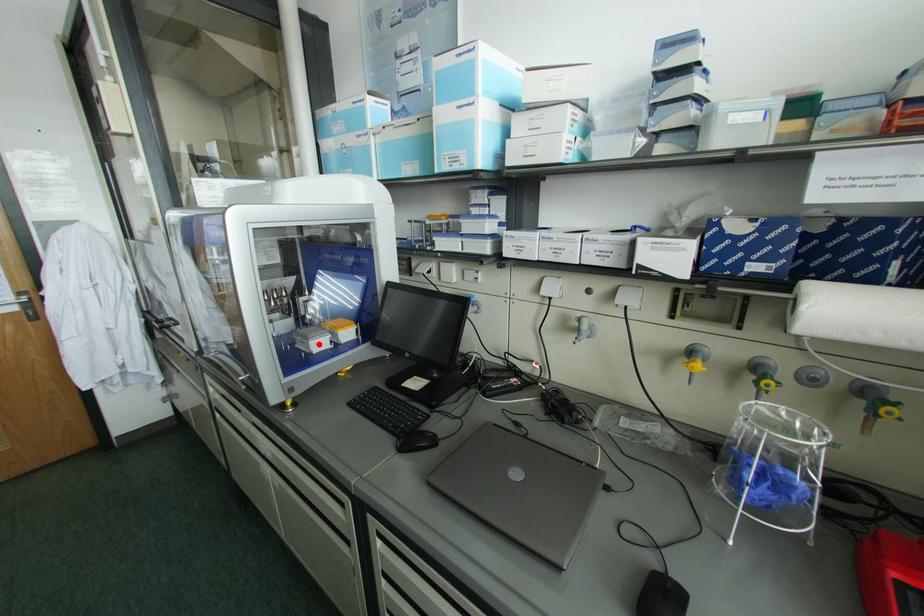
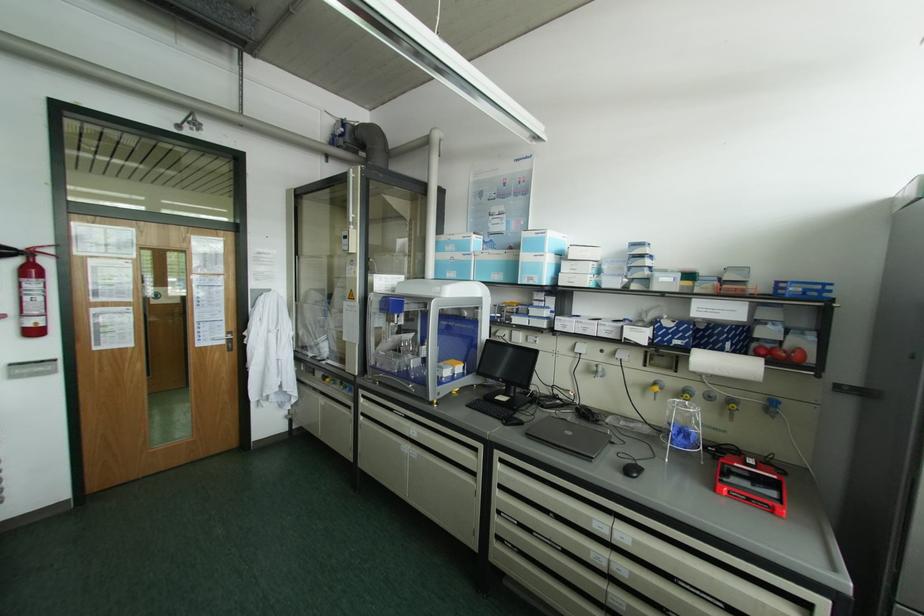
Locate, in the second image, the point that corresponds to the highlighted location in the first image.

(445, 371)